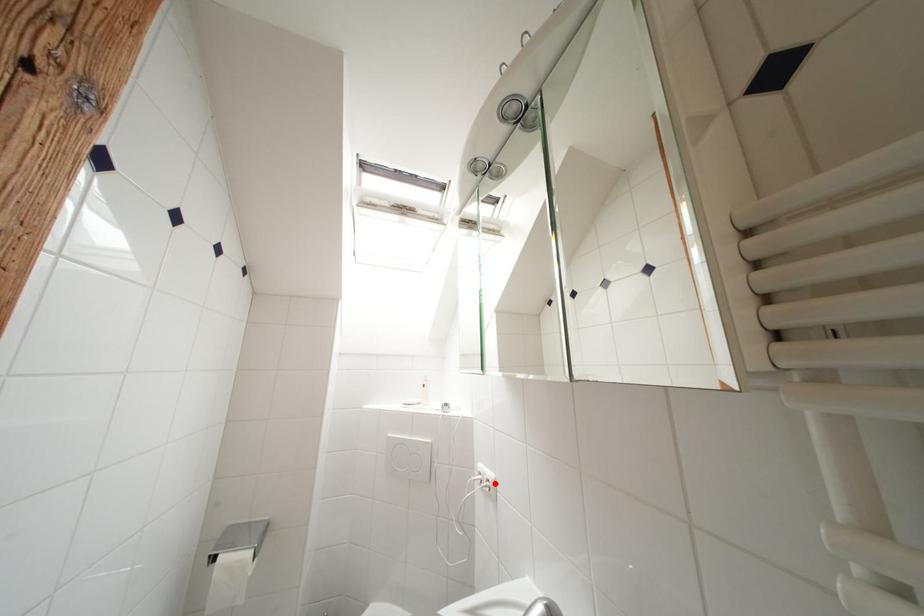
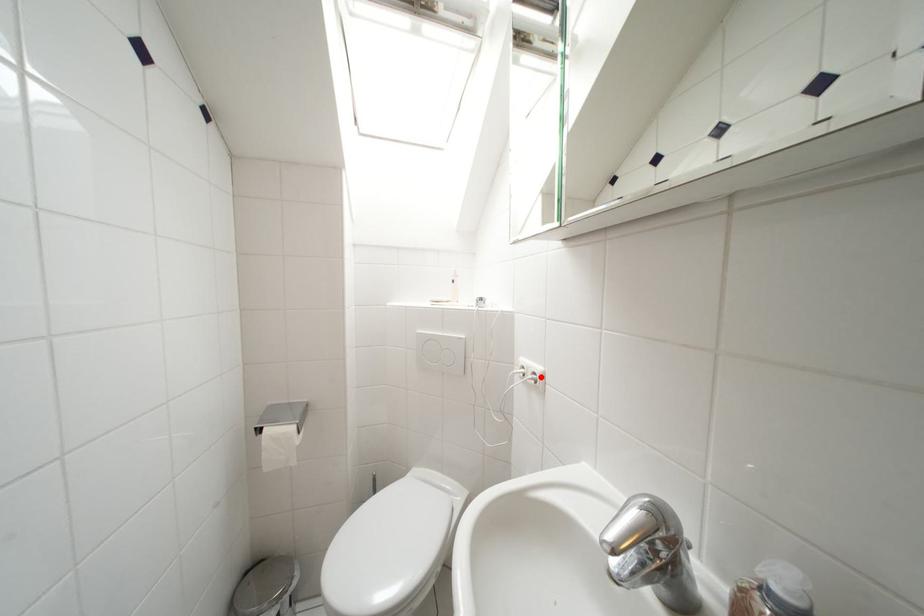
I am providing you with two images of the same scene from different viewpoints. A red point is marked on the first image and another point is marked on the second image. Does the point marked in image1 correspond to the same location as the one in image2?

Yes